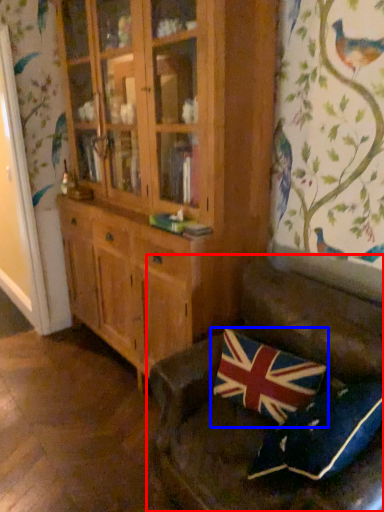
Question: Among these objects, which one is farthest to the camera, studio couch (highlighted by a red box) or pillow (highlighted by a blue box)?

Choices:
 (A) studio couch
 (B) pillow

Answer: (B)